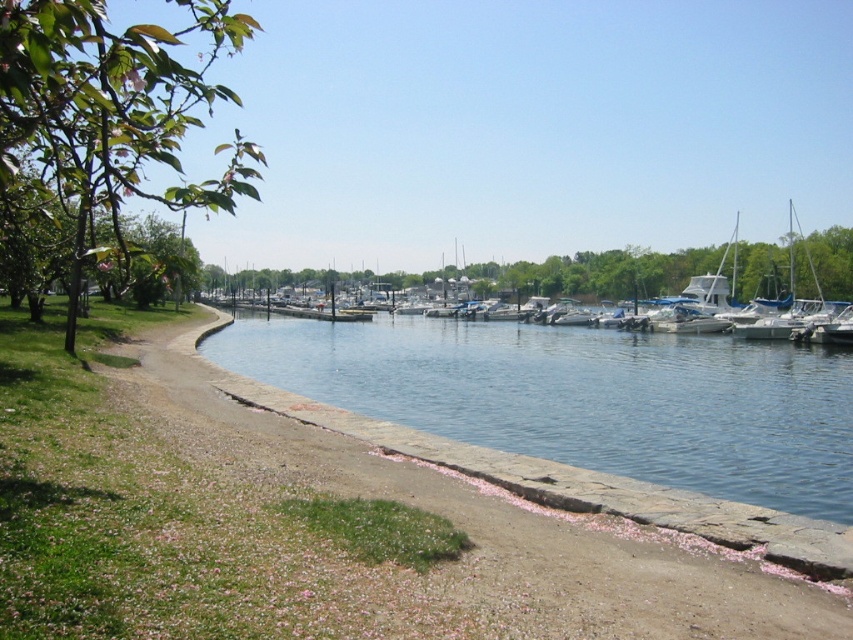
You are standing on the pathway and want to take a photo of both the clear blue water at center and the white glossy boat at center. Which object will appear larger in your camera viewfinder?

The clear blue water at center will appear larger in the camera viewfinder because it is closer to the viewer than the white glossy boat at center.

You are a tour guide leading a group of visitors to the waterfront. You want to inform them about the distance between the clear blue water at center and the white glossy boat at center. How far apart are these two landmarks?

The clear blue water at center and the white glossy boat at center are 152.93 feet apart.